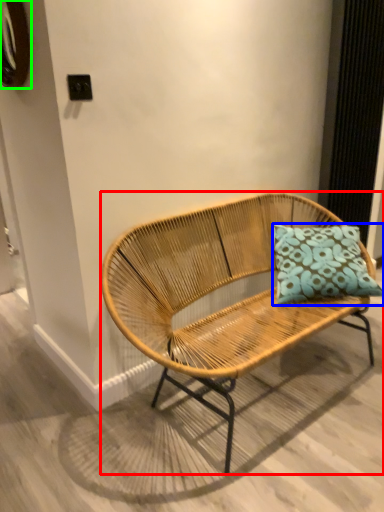
Question: Which is nearer to the bench (highlighted by a red box)? pillow (highlighted by a blue box) or oval (highlighted by a green box).

Choices:
 (A) pillow
 (B) oval

Answer: (A)